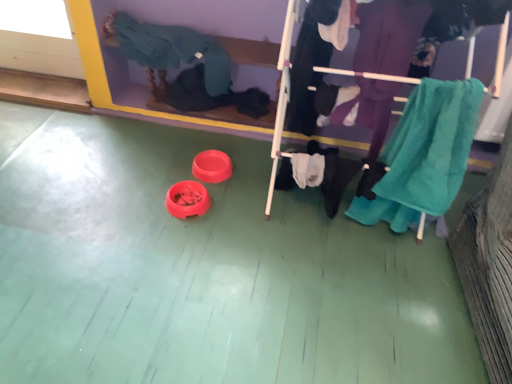
Identify the location of free space in front of teal towel at right, the first clothing positioned from the right. Image resolution: width=512 pixels, height=384 pixels. (396, 290).